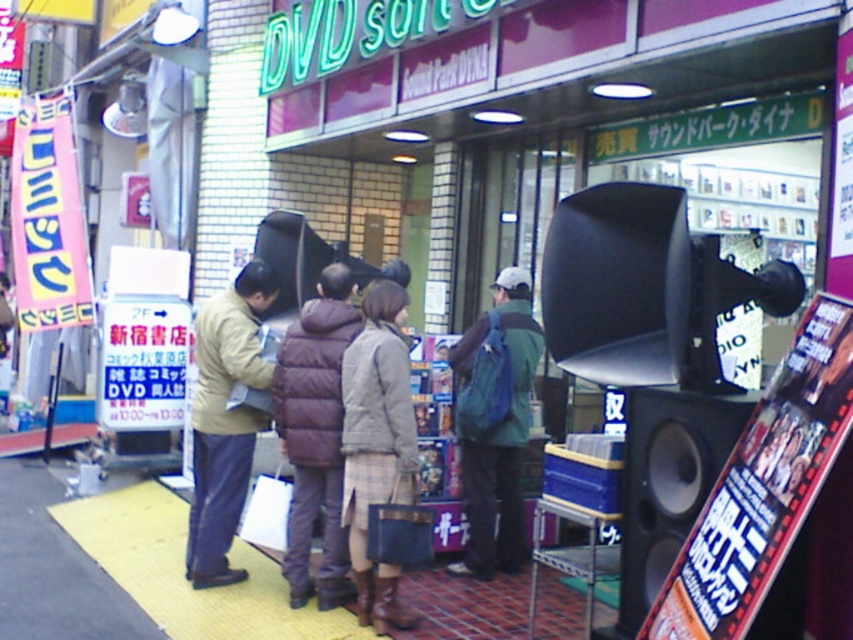
You are standing at the point labeled as point (666, 483) in the image. What object is located at this point?

The point (666, 483) corresponds to the black matte speaker at right.

Consider the image. You are a delivery person who needs to place a large package on the ground near the black matte speaker at right and the green fabric backpack at center. Which object should you move to make space?

The black matte speaker at right has a lesser height compared to the green fabric backpack at center, so you should move the green fabric backpack at center to make space because it is taller and might block the area.

You are standing at point (206, 355) and want to walk to the shop entrance located at point (627, 417). Is the shop entrance directly in front of you?

Yes, the shop entrance at point (627, 417) is directly in front of you because it is positioned in front of your current location at point (206, 355).